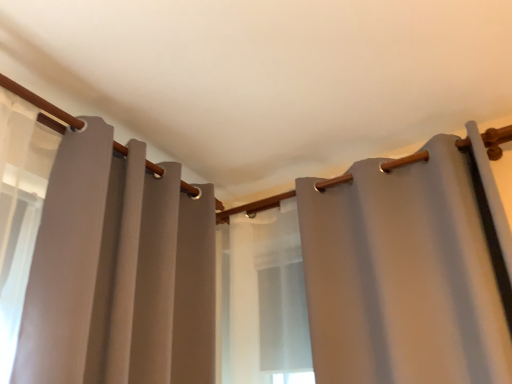
This screenshot has width=512, height=384. What do you see at coordinates (253, 206) in the screenshot?
I see `wooden curtain rod at center` at bounding box center [253, 206].

Where is `wooden curtain rod at center`? wooden curtain rod at center is located at coordinates (253, 206).

You are a GUI agent. You are given a task and a screenshot of the screen. Output one action in this format:
    pyautogui.click(x=<x>, y=<y>)
    Task: Click on the wooden curtain rod at center
    This screenshot has width=512, height=384.
    Given the screenshot: What is the action you would take?
    pyautogui.click(x=253, y=206)